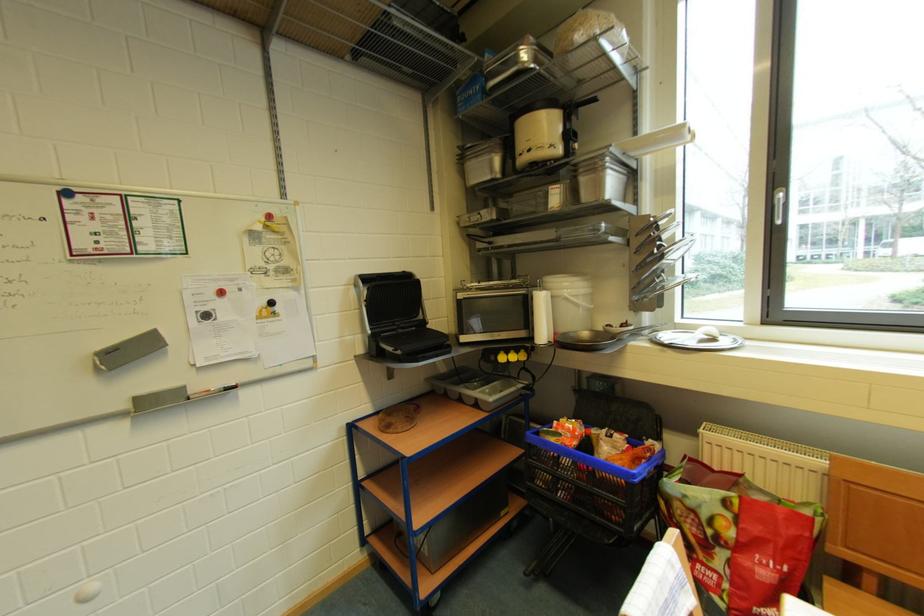
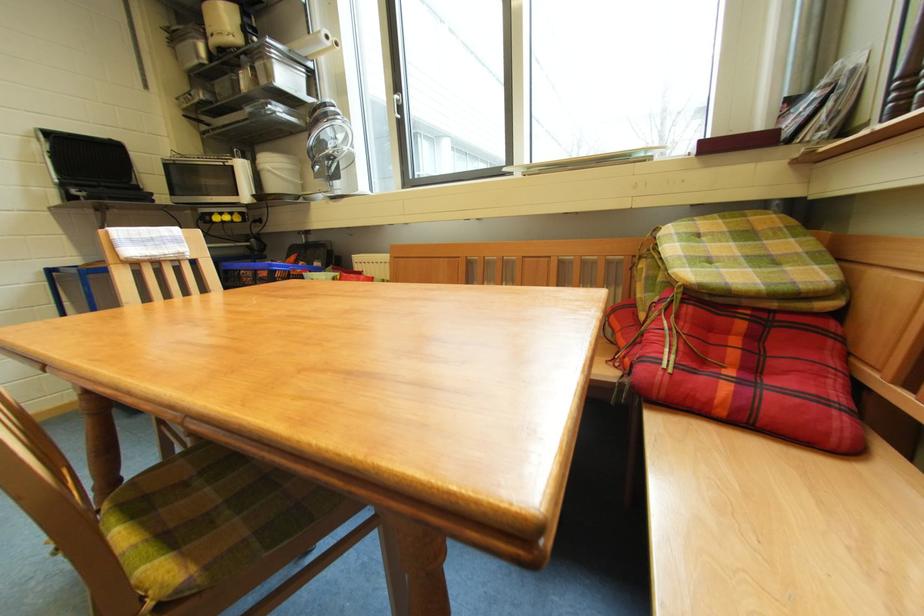
Where in the second image is the point corresponding to the point at 785,204 from the first image?

(402, 102)